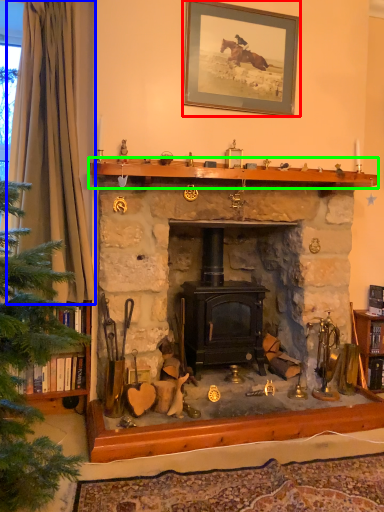
Question: Which object is the farthest from picture frame (highlighted by a red box)? Choose among these: curtain (highlighted by a blue box) or mantle (highlighted by a green box).

Choices:
 (A) curtain
 (B) mantle

Answer: (A)